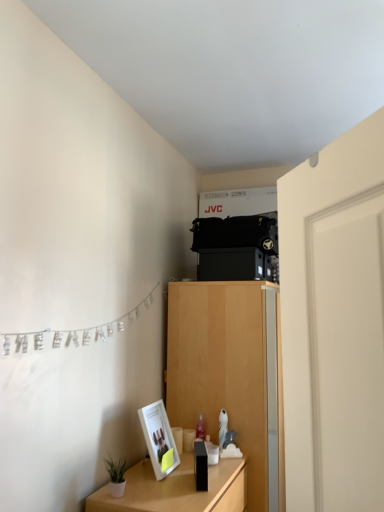
Question: Is silver metallic banner at left in front of wooden table at lower left?

Choices:
 (A) no
 (B) yes

Answer: (B)

Question: Is silver metallic banner at left outside wooden table at lower left?

Choices:
 (A) yes
 (B) no

Answer: (A)

Question: Is wooden table at lower left surrounded by silver metallic banner at left?

Choices:
 (A) yes
 (B) no

Answer: (B)

Question: Are silver metallic banner at left and wooden table at lower left far apart?

Choices:
 (A) yes
 (B) no

Answer: (B)

Question: From a real-world perspective, is silver metallic banner at left located higher than wooden table at lower left?

Choices:
 (A) yes
 (B) no

Answer: (A)

Question: From the image's perspective, is wooden table at lower left above or below white smooth door at right?

Choices:
 (A) above
 (B) below

Answer: (B)

Question: From a real-world perspective, is wooden table at lower left positioned above or below white smooth door at right?

Choices:
 (A) below
 (B) above

Answer: (A)

Question: Is point (203, 509) closer or farther from the camera than point (294, 190)?

Choices:
 (A) closer
 (B) farther

Answer: (B)

Question: Is wooden table at lower left wider or thinner than white smooth door at right?

Choices:
 (A) thin
 (B) wide

Answer: (B)

Question: In terms of height, does wooden table at lower left look taller or shorter compared to silver metallic banner at left?

Choices:
 (A) tall
 (B) short

Answer: (A)

Question: Is wooden table at lower left inside or outside of silver metallic banner at left?

Choices:
 (A) inside
 (B) outside

Answer: (B)

Question: From a real-world perspective, is wooden table at lower left above or below silver metallic banner at left?

Choices:
 (A) above
 (B) below

Answer: (B)

Question: In the image, is wooden table at lower left positioned in front of or behind silver metallic banner at left?

Choices:
 (A) behind
 (B) front

Answer: (A)

Question: Considering the positions of wooden table at lower left and light wood cabinet at center in the image, is wooden table at lower left bigger or smaller than light wood cabinet at center?

Choices:
 (A) big
 (B) small

Answer: (B)

Question: Is wooden table at lower left inside the boundaries of light wood cabinet at center, or outside?

Choices:
 (A) outside
 (B) inside

Answer: (A)